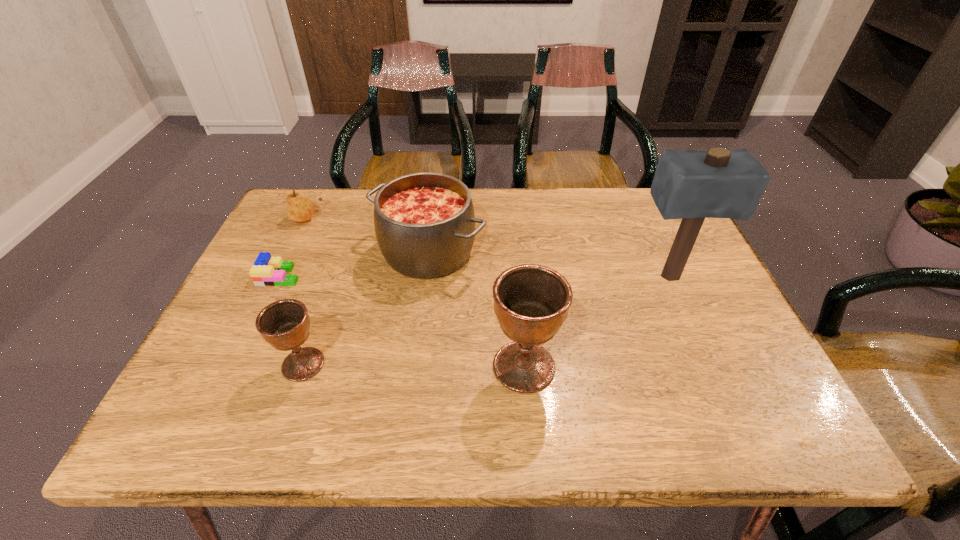
Considering the uniform spacing of chalices, where should an additional chalice be positioned on the right? Please locate a free spot. Please provide its 2D coordinates. Your answer should be formatted as a tuple, i.e. [(x, y)], where the tuple contains the x and y coordinates of a point satisfying the conditions above.

[(747, 369)]